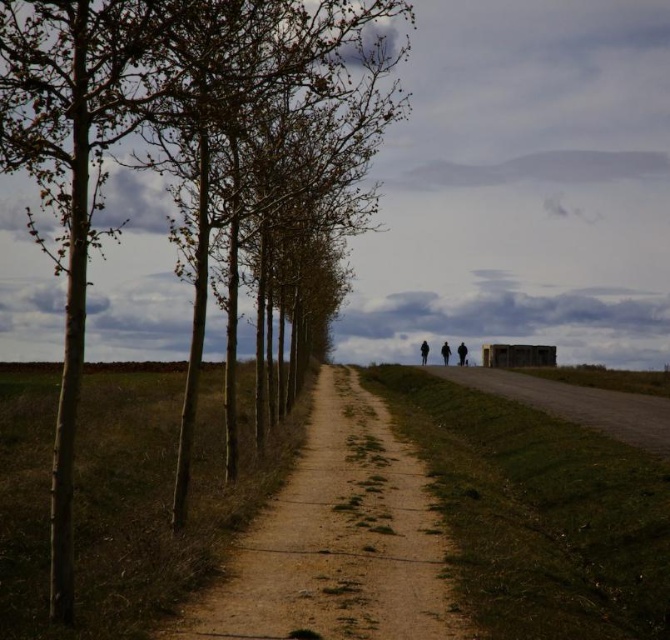
You are a hiker who wants to take a photo of the smooth bark trees at left and the dark textured coat at center. Which object should you focus on first if you want to capture both in a single frame without moving the camera?

The smooth bark trees at left is larger in size than the dark textured coat at center, so you should focus on the smooth bark trees at left first to ensure they are in clear view before adjusting the focus to include the smaller dark textured coat at center.

You are standing at the center of the dirt path in the rural scene. You want to walk towards the smooth bark trees at left. Which direction should you move?

The smooth bark trees at left are located at point 0.200 on the x axis and 0.249 on the y axis. Since you are at the center of the dirt path, you should move towards the left direction to reach them.